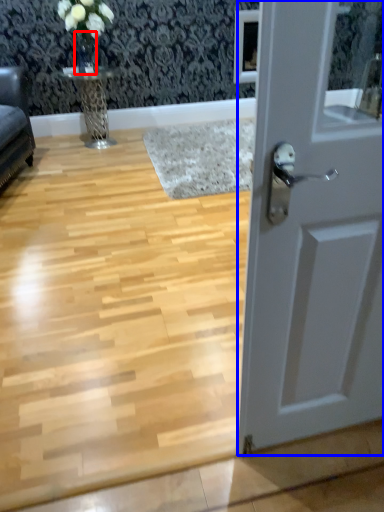
Question: Which object is further to the camera taking this photo, glass vase (highlighted by a red box) or door (highlighted by a blue box)?

Choices:
 (A) glass vase
 (B) door

Answer: (A)